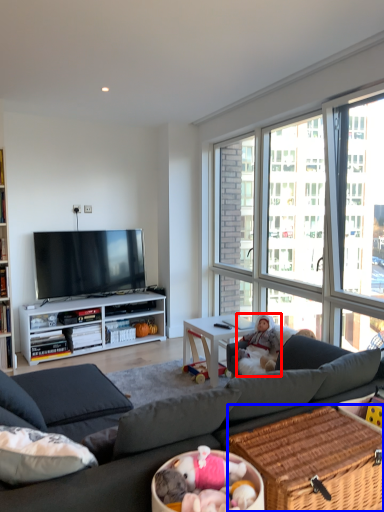
Question: Which object appears farthest to the camera in this image, person (highlighted by a red box) or picnic basket (highlighted by a blue box)?

Choices:
 (A) person
 (B) picnic basket

Answer: (A)